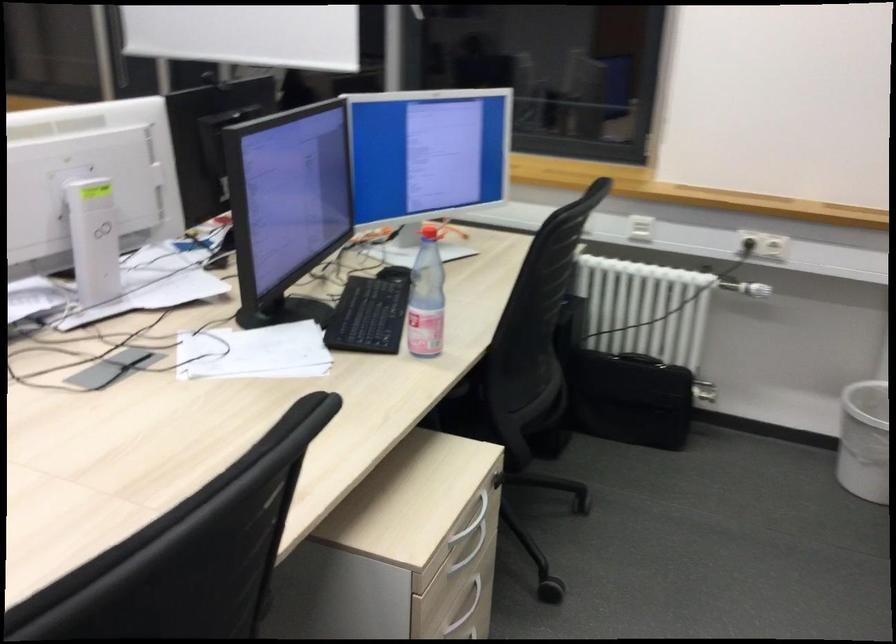
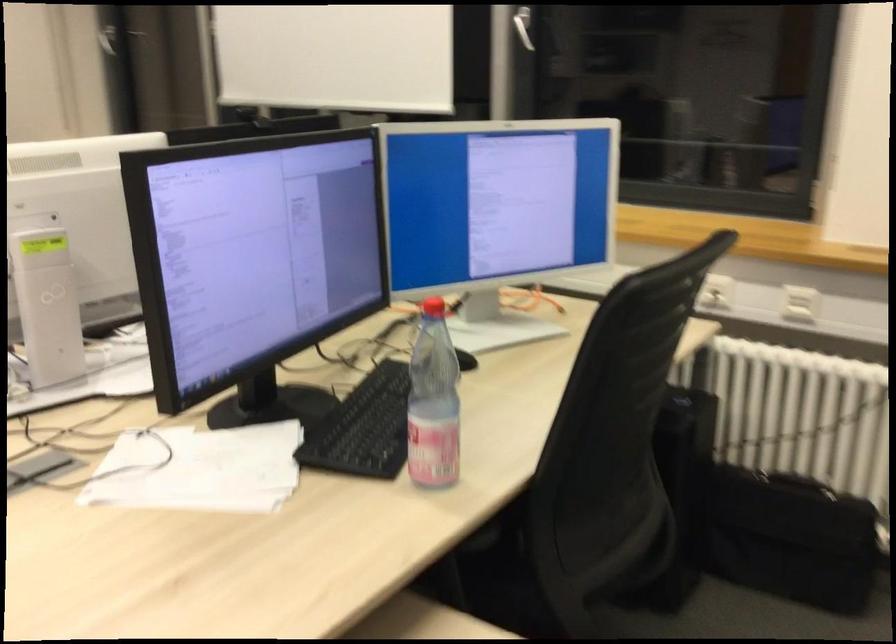
Find the pixel in the second image that matches (x=457, y=404) in the first image.

(503, 545)